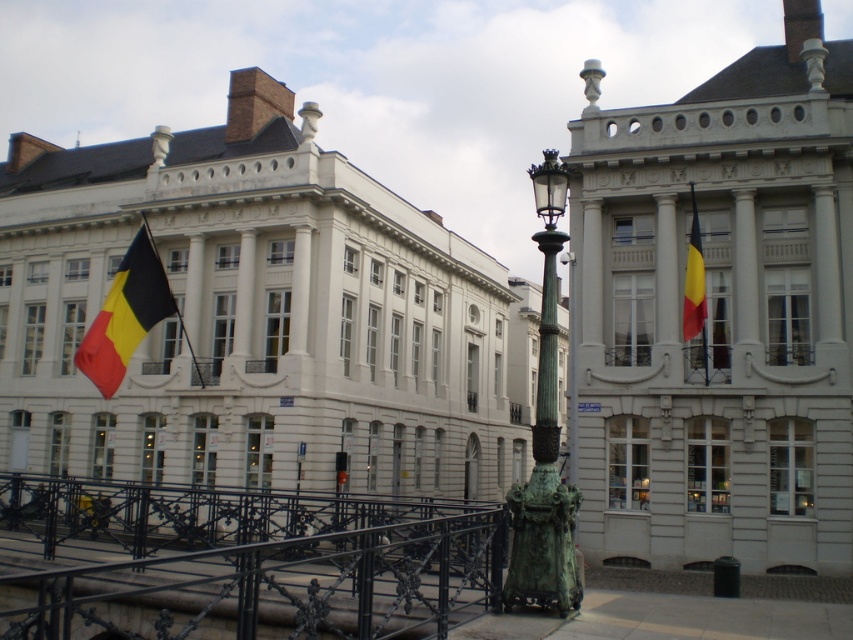
You are a GUI agent. You are given a task and a screenshot of the screen. Output one action in this format:
    pyautogui.click(x=<x>, y=<y>)
    Task: Click on the black wrought iron railing at lower left
    This screenshot has height=640, width=853.
    Given the screenshot: What is the action you would take?
    pyautogui.click(x=238, y=563)

Between black wrought iron railing at lower left and matte fabric flag at left, which one is positioned lower?

black wrought iron railing at lower left is below.

Between point (450, 596) and point (96, 324), which one is positioned in front?

Point (450, 596) is more forward.

Find the location of a particular element. black wrought iron railing at lower left is located at coordinates (238, 563).

Between point (149, 257) and point (164, 275), which one is positioned behind?

The point (164, 275) is behind.

From the picture: Who is lower down, matte fabric flag at left or polished metal flag pole at center?

matte fabric flag at left is below.

Is point (177, 308) in front of point (186, 330)?

Yes, point (177, 308) is closer to viewer.

Where is `matte fabric flag at left`? Image resolution: width=853 pixels, height=640 pixels. matte fabric flag at left is located at coordinates (125, 314).

Is white stone building at center taller than bronze statue at center?

Yes, white stone building at center is taller than bronze statue at center.

Which is in front, point (167, 348) or point (512, 593)?

Point (512, 593) is more forward.

Where is `white stone building at center`? white stone building at center is located at coordinates (259, 317).